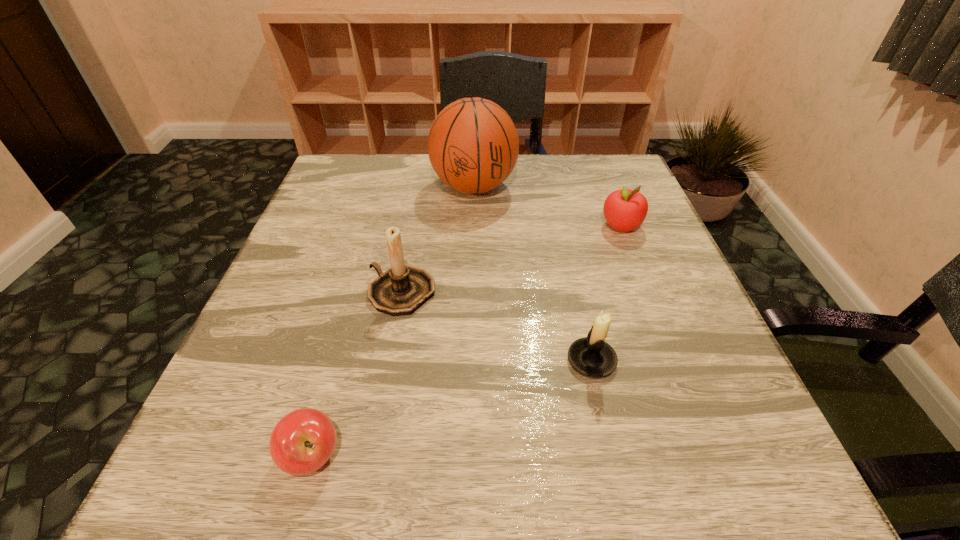
At what (x,y) coordinates should I click in order to perform the action: click on the tallest object. Please return your answer as a coordinate pair (x, y). Looking at the image, I should click on (473, 145).

I want to click on basketball, so click(x=473, y=145).

At what (x,y) coordinates should I click in order to perform the action: click on the taller candle holder. Please return your answer as a coordinate pair (x, y). This screenshot has height=540, width=960. Looking at the image, I should click on (401, 290).

Locate an element on the screen. the third nearest object is located at coordinates point(401,290).

Identify the location of the right candle holder. (592, 356).

Find the location of a particular element. the second nearest object is located at coordinates (592, 356).

Find the location of a particular element. The width and height of the screenshot is (960, 540). the rightmost object is located at coordinates (625, 210).

You are a GUI agent. You are given a task and a screenshot of the screen. Output one action in this format:
    pyautogui.click(x=<x>, y=<y>)
    Task: Click on the taller apple
    The height and width of the screenshot is (540, 960).
    Given the screenshot: What is the action you would take?
    pyautogui.click(x=625, y=210)

Find the location of `the nearer apple`. the nearer apple is located at coordinates (302, 441).

This screenshot has width=960, height=540. I want to click on the shortest object, so click(302, 441).